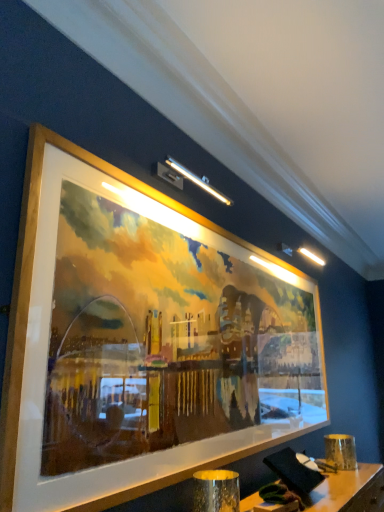
The image size is (384, 512). What do you see at coordinates (142, 339) in the screenshot?
I see `wooden picture frame at upper center` at bounding box center [142, 339].

Where is `wooden picture frame at upper center`? The height and width of the screenshot is (512, 384). wooden picture frame at upper center is located at coordinates (142, 339).

Where is `wooden picture frame at upper center`? This screenshot has width=384, height=512. wooden picture frame at upper center is located at coordinates (142, 339).